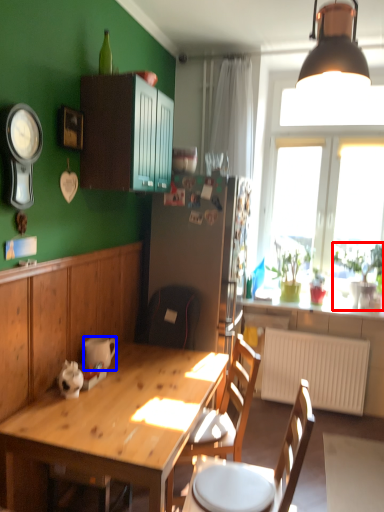
Question: Which of the following is the closest to the observer, houseplant (highlighted by a red box) or coffee cup (highlighted by a blue box)?

Choices:
 (A) houseplant
 (B) coffee cup

Answer: (B)